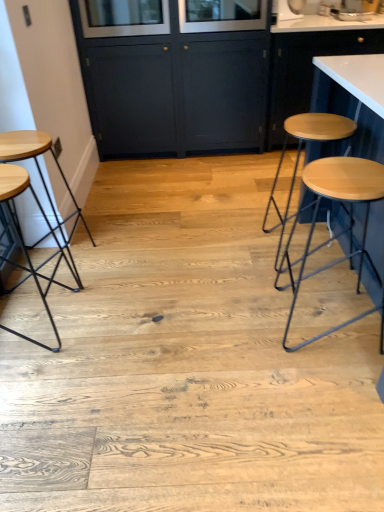
This screenshot has height=512, width=384. What do you see at coordinates (307, 67) in the screenshot? I see `white glossy countertop at upper right, the second cabinetry positioned from the left` at bounding box center [307, 67].

Where is `dark blue wood cabinet at center, marked as the second cabinetry in a right-to-left arrangement`? The height and width of the screenshot is (512, 384). dark blue wood cabinet at center, marked as the second cabinetry in a right-to-left arrangement is located at coordinates (174, 74).

Where is `wooden seat at left, placed as the second stool when sorted from right to left`? The width and height of the screenshot is (384, 512). wooden seat at left, placed as the second stool when sorted from right to left is located at coordinates point(39,170).

You are a GUI agent. You are given a task and a screenshot of the screen. Output one action in this format:
    pyautogui.click(x=<x>, y=<y>)
    Task: Click on the white glossy sink at upper right
    The height and width of the screenshot is (512, 384).
    Given the screenshot: What is the action you would take?
    pyautogui.click(x=349, y=9)

In order to click on clear glass window screen at upper center, the 1th window screen positioned from the right in this screenshot , I will do `click(221, 15)`.

The image size is (384, 512). What do you see at coordinates (349, 224) in the screenshot?
I see `wooden stool at right, which is the first stool from right to left` at bounding box center [349, 224].

Identify the location of white glossy countertop at upper right, the first cabinetry in the right-to-left sequence. (307, 67).

From a real-world perspective, starting from the clear glass window screen at upper center, placed as the first window screen when sorted from left to right, which cabinetry is the 1st one below it? Please provide its 2D coordinates.

[(174, 74)]

Is clear glass window screen at upper center, placed as the first window screen when sorted from left to right, to the left of dark blue wood cabinet at center, arranged as the 1th cabinetry when viewed from the left, from the viewer's perspective?

Indeed, clear glass window screen at upper center, placed as the first window screen when sorted from left to right, is positioned on the left side of dark blue wood cabinet at center, arranged as the 1th cabinetry when viewed from the left.

Does clear glass window screen at upper center, which is counted as the 2th window screen, starting from the right, lie in front of dark blue wood cabinet at center, arranged as the 1th cabinetry when viewed from the left?

No, clear glass window screen at upper center, which is counted as the 2th window screen, starting from the right, is further to the viewer.

Considering the relative sizes of clear glass window screen at upper center, which is counted as the 2th window screen, starting from the right, and dark blue wood cabinet at center, marked as the second cabinetry in a right-to-left arrangement, in the image provided, is clear glass window screen at upper center, which is counted as the 2th window screen, starting from the right, bigger than dark blue wood cabinet at center, marked as the second cabinetry in a right-to-left arrangement,?

No, clear glass window screen at upper center, which is counted as the 2th window screen, starting from the right, is not bigger than dark blue wood cabinet at center, marked as the second cabinetry in a right-to-left arrangement.

Considering the relative sizes of white glossy countertop at upper right, the second cabinetry positioned from the left, and white glossy sink at upper right in the image provided, is white glossy countertop at upper right, the second cabinetry positioned from the left, shorter than white glossy sink at upper right?

Incorrect, the height of white glossy countertop at upper right, the second cabinetry positioned from the left, does not fall short of that of white glossy sink at upper right.

Consider the image. From the image's perspective, is white glossy countertop at upper right, the first cabinetry in the right-to-left sequence, on white glossy sink at upper right?

Incorrect, from the image's perspective, white glossy countertop at upper right, the first cabinetry in the right-to-left sequence, is lower than white glossy sink at upper right.

Which is nearer, (310, 78) or (368, 16)?

The point (310, 78) is closer to the camera.

Is white glossy countertop at upper right, the second cabinetry positioned from the left, oriented towards white glossy sink at upper right?

No, white glossy countertop at upper right, the second cabinetry positioned from the left, does not turn towards white glossy sink at upper right.

Is point (169, 102) positioned behind point (266, 10)?

That is True.

Which is behind, dark blue wood cabinet at center, arranged as the 1th cabinetry when viewed from the left, or clear glass window screen at upper center, the 2th window screen positioned from the left?

Positioned behind is clear glass window screen at upper center, the 2th window screen positioned from the left.

This screenshot has height=512, width=384. I want to click on the 2nd window screen behind the dark blue wood cabinet at center, marked as the second cabinetry in a right-to-left arrangement, so click(x=221, y=15).

Which of these two, dark blue wood cabinet at center, arranged as the 1th cabinetry when viewed from the left, or clear glass window screen at upper center, the 1th window screen positioned from the right, stands taller?

dark blue wood cabinet at center, arranged as the 1th cabinetry when viewed from the left, is taller.

Can you confirm if white glossy countertop at upper right, the first cabinetry in the right-to-left sequence, is wider than dark blue wood cabinet at center, marked as the second cabinetry in a right-to-left arrangement?

No.

Would you say white glossy countertop at upper right, the second cabinetry positioned from the left, is outside dark blue wood cabinet at center, arranged as the 1th cabinetry when viewed from the left?

Yes, white glossy countertop at upper right, the second cabinetry positioned from the left, is located beyond the bounds of dark blue wood cabinet at center, arranged as the 1th cabinetry when viewed from the left.

From the image's perspective, which is above, white glossy countertop at upper right, the second cabinetry positioned from the left, or dark blue wood cabinet at center, arranged as the 1th cabinetry when viewed from the left?

white glossy countertop at upper right, the second cabinetry positioned from the left, appears higher in the image.

Does white glossy countertop at upper right, the first cabinetry in the right-to-left sequence, have a greater height compared to dark blue wood cabinet at center, marked as the second cabinetry in a right-to-left arrangement?

In fact, white glossy countertop at upper right, the first cabinetry in the right-to-left sequence, may be shorter than dark blue wood cabinet at center, marked as the second cabinetry in a right-to-left arrangement.

Between wooden seat at left, which is the 1th stool from left to right, and dark blue wood cabinet at center, arranged as the 1th cabinetry when viewed from the left, which one has smaller size?

Smaller between the two is wooden seat at left, which is the 1th stool from left to right.

Which is nearer, [52,234] or [174,60]?

The point [52,234] is closer.

Does wooden seat at left, which is the 1th stool from left to right, touch dark blue wood cabinet at center, marked as the second cabinetry in a right-to-left arrangement?

wooden seat at left, which is the 1th stool from left to right, and dark blue wood cabinet at center, marked as the second cabinetry in a right-to-left arrangement, are not in contact.

From the image's perspective, is dark blue wood cabinet at center, marked as the second cabinetry in a right-to-left arrangement, below white glossy sink at upper right?

Correct, dark blue wood cabinet at center, marked as the second cabinetry in a right-to-left arrangement, appears lower than white glossy sink at upper right in the image.

In the scene shown: Is dark blue wood cabinet at center, marked as the second cabinetry in a right-to-left arrangement, bigger than white glossy sink at upper right?

Yes.

Does point (208, 75) lie behind point (325, 2)?

No, it is not.

Based on their sizes in the image, would you say clear glass window screen at upper center, the 1th window screen positioned from the right, is bigger or smaller than wooden seat at left, which is the 1th stool from left to right?

Considering their sizes, clear glass window screen at upper center, the 1th window screen positioned from the right, takes up less space than wooden seat at left, which is the 1th stool from left to right.

Is clear glass window screen at upper center, the 1th window screen positioned from the right, wider than wooden seat at left, placed as the second stool when sorted from right to left?

Yes, clear glass window screen at upper center, the 1th window screen positioned from the right, is wider than wooden seat at left, placed as the second stool when sorted from right to left.

The image size is (384, 512). There is a wooden seat at left, placed as the second stool when sorted from right to left. In order to click on the 2nd window screen above it (from the image's perspective) in this screenshot , I will do `click(221, 15)`.

From the dark blue wood cabinet at center, marked as the second cabinetry in a right-to-left arrangement, count 1st window screens backward and point to it. Please provide its 2D coordinates.

[(124, 17)]

The width and height of the screenshot is (384, 512). Identify the location of sink located in front of the white glossy countertop at upper right, the first cabinetry in the right-to-left sequence. (349, 9).

Consider the image. Considering their positions, is dark blue wood cabinet at center, arranged as the 1th cabinetry when viewed from the left, positioned further to clear glass window screen at upper center, the 2th window screen positioned from the left, than white glossy sink at upper right?

white glossy sink at upper right lies further to clear glass window screen at upper center, the 2th window screen positioned from the left, than the other object.

When comparing their distances from clear glass window screen at upper center, the 2th window screen positioned from the left, does clear glass window screen at upper center, placed as the first window screen when sorted from left to right, or dark blue wood cabinet at center, arranged as the 1th cabinetry when viewed from the left, seem closer?

dark blue wood cabinet at center, arranged as the 1th cabinetry when viewed from the left, lies closer to clear glass window screen at upper center, the 2th window screen positioned from the left, than the other object.

Considering their positions, is clear glass window screen at upper center, the 1th window screen positioned from the right, positioned closer to white glossy countertop at upper right, the second cabinetry positioned from the left, than white glossy sink at upper right?

clear glass window screen at upper center, the 1th window screen positioned from the right, is positioned closer to the anchor white glossy countertop at upper right, the second cabinetry positioned from the left.

In the scene shown: From the image, which object appears to be farther from white glossy countertop at upper right, the second cabinetry positioned from the left, dark blue wood cabinet at center, marked as the second cabinetry in a right-to-left arrangement, or clear glass window screen at upper center, the 1th window screen positioned from the right?

dark blue wood cabinet at center, marked as the second cabinetry in a right-to-left arrangement, is positioned further to the anchor white glossy countertop at upper right, the second cabinetry positioned from the left.

Looking at the image, which one is located further to clear glass window screen at upper center, placed as the first window screen when sorted from left to right, dark blue wood cabinet at center, marked as the second cabinetry in a right-to-left arrangement, or clear glass window screen at upper center, the 2th window screen positioned from the left?

The object further to clear glass window screen at upper center, placed as the first window screen when sorted from left to right, is clear glass window screen at upper center, the 2th window screen positioned from the left.

Looking at the image, which one is located closer to wooden seat at left, placed as the second stool when sorted from right to left, wooden stool at right, the second stool positioned from the left, or dark blue wood cabinet at center, marked as the second cabinetry in a right-to-left arrangement?

The object closer to wooden seat at left, placed as the second stool when sorted from right to left, is dark blue wood cabinet at center, marked as the second cabinetry in a right-to-left arrangement.

Looking at the image, which one is located further to white glossy countertop at upper right, the first cabinetry in the right-to-left sequence, white glossy sink at upper right or clear glass window screen at upper center, which is counted as the 2th window screen, starting from the right?

Among the two, clear glass window screen at upper center, which is counted as the 2th window screen, starting from the right, is located further to white glossy countertop at upper right, the first cabinetry in the right-to-left sequence.

Which object lies further to the anchor point white glossy sink at upper right, dark blue wood cabinet at center, marked as the second cabinetry in a right-to-left arrangement, or clear glass window screen at upper center, the 2th window screen positioned from the left?

dark blue wood cabinet at center, marked as the second cabinetry in a right-to-left arrangement, lies further to white glossy sink at upper right than the other object.

This screenshot has width=384, height=512. Find the location of `window screen between dark blue wood cabinet at center, arranged as the 1th cabinetry when viewed from the left, and white glossy countertop at upper right, the second cabinetry positioned from the left, from left to right`. window screen between dark blue wood cabinet at center, arranged as the 1th cabinetry when viewed from the left, and white glossy countertop at upper right, the second cabinetry positioned from the left, from left to right is located at coordinates (221, 15).

This screenshot has height=512, width=384. I want to click on stool between wooden seat at left, which is the 1th stool from left to right, and white glossy sink at upper right, in the horizontal direction, so (349, 224).

Find the location of a particular element. This screenshot has width=384, height=512. stool between dark blue wood cabinet at center, arranged as the 1th cabinetry when viewed from the left, and wooden stool at right, the second stool positioned from the left, in the vertical direction is located at coordinates [39, 170].

Locate an element on the screen. This screenshot has height=512, width=384. cabinetry positioned between wooden stool at right, the second stool positioned from the left, and white glossy countertop at upper right, the second cabinetry positioned from the left, from near to far is located at coordinates (174, 74).